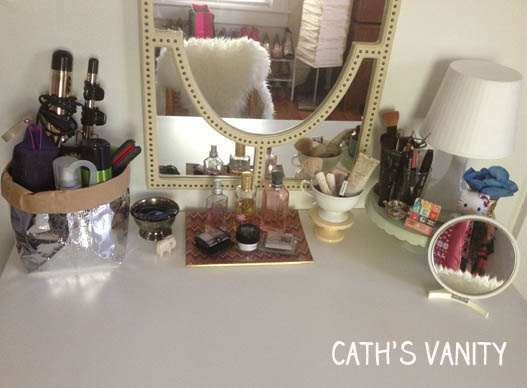
This screenshot has width=527, height=388. Identify the location of perfume. (x=275, y=201), (x=242, y=192), (x=217, y=198).